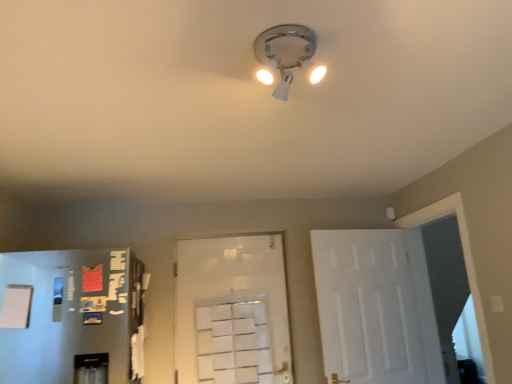
Question: Does white matte door at center, acting as the first door starting from the left, have a lesser height compared to matte white light fixture at center?

Choices:
 (A) yes
 (B) no

Answer: (B)

Question: From the image's perspective, would you say white matte door at center, the second door positioned from the right, is shown under matte white light fixture at center?

Choices:
 (A) no
 (B) yes

Answer: (B)

Question: Is white matte door at center, acting as the first door starting from the left, not close to matte white light fixture at center?

Choices:
 (A) no
 (B) yes

Answer: (B)

Question: From a real-world perspective, does white matte door at center, acting as the first door starting from the left, sit lower than matte white light fixture at center?

Choices:
 (A) no
 (B) yes

Answer: (B)

Question: Considering the relative sizes of white matte door at center, the second door positioned from the right, and matte white light fixture at center in the image provided, is white matte door at center, the second door positioned from the right, wider than matte white light fixture at center?

Choices:
 (A) no
 (B) yes

Answer: (A)

Question: Is white matte door at center, the second door positioned from the right, surrounding matte white light fixture at center?

Choices:
 (A) no
 (B) yes

Answer: (A)

Question: From a real-world perspective, is white matte door at right, which ranks as the 1th door in right-to-left order, on top of matte white light fixture at center?

Choices:
 (A) no
 (B) yes

Answer: (A)

Question: From a real-world perspective, is white matte door at right, the 2th door viewed from the left, located beneath matte white light fixture at center?

Choices:
 (A) no
 (B) yes

Answer: (B)

Question: Is white matte door at right, which ranks as the 1th door in right-to-left order, taller than matte white light fixture at center?

Choices:
 (A) no
 (B) yes

Answer: (B)

Question: Is there a large distance between white matte door at right, which ranks as the 1th door in right-to-left order, and matte white light fixture at center?

Choices:
 (A) yes
 (B) no

Answer: (A)

Question: Can you confirm if white matte door at right, which ranks as the 1th door in right-to-left order, is shorter than matte white light fixture at center?

Choices:
 (A) no
 (B) yes

Answer: (A)

Question: Can you confirm if white matte door at right, the 2th door viewed from the left, is positioned to the left of matte white light fixture at center?

Choices:
 (A) yes
 (B) no

Answer: (B)

Question: From a real-world perspective, is matte white light fixture at center physically below white matte door at right, the 2th door viewed from the left?

Choices:
 (A) no
 (B) yes

Answer: (A)